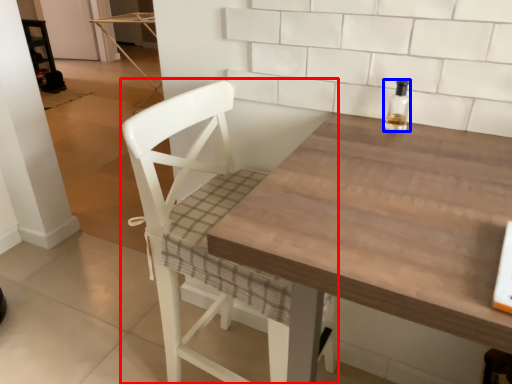
Question: Which of the following is the closest to the observer, chair (highlighted by a red box) or bottle (highlighted by a blue box)?

Choices:
 (A) chair
 (B) bottle

Answer: (A)